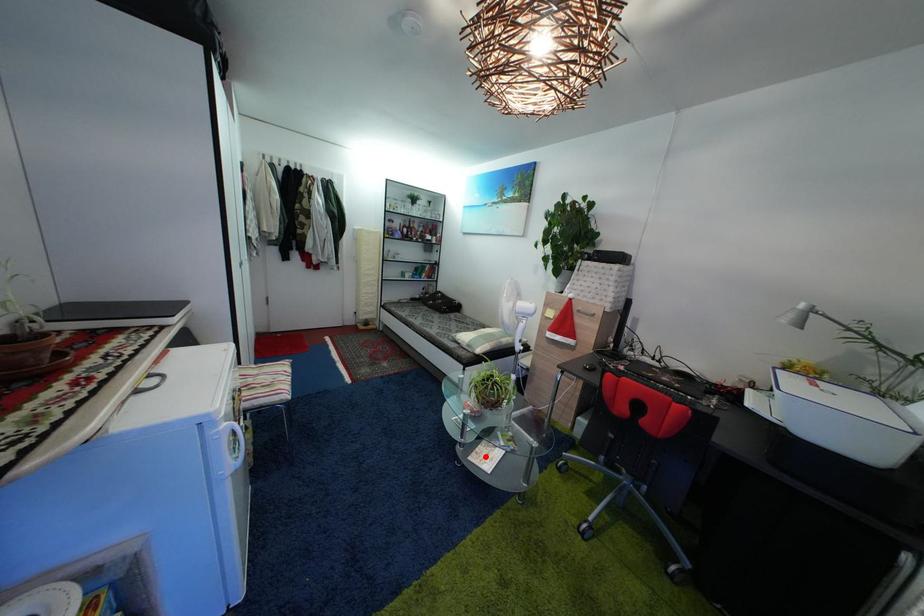
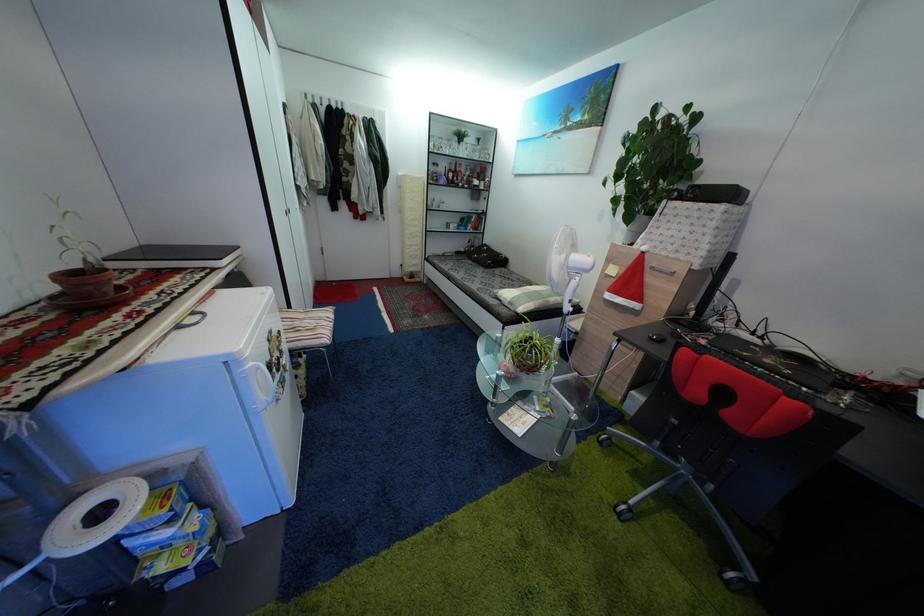
Where in the second image is the point corresponding to the highlighted location from the first image?

(517, 418)